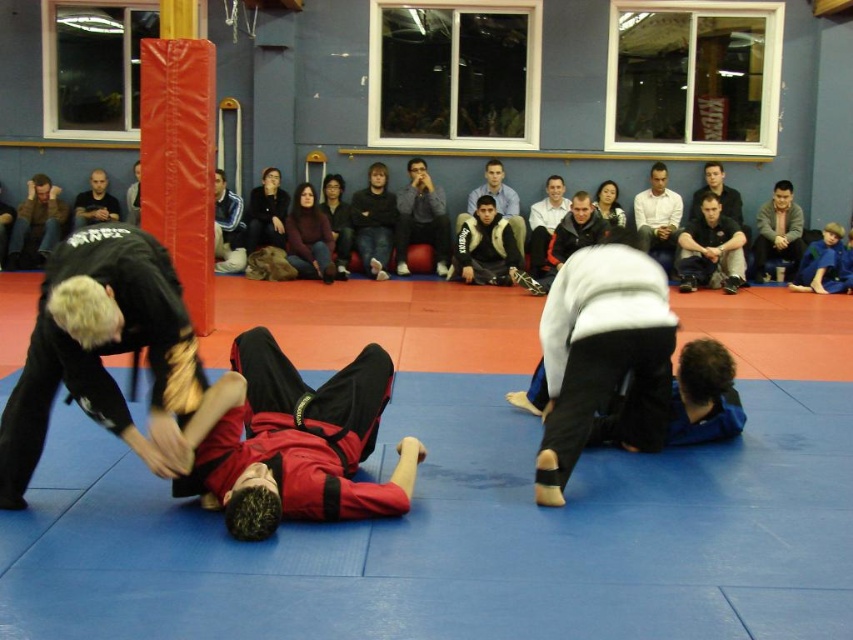
You are a martial arts instructor observing the training session. You notice a point at coordinates (x=486, y=248) on the image. Which object in the scene is this point located on?

The point at coordinates (x=486, y=248) is located on the dark gray fleece jacket at center.

Consider the image. You are a martial arts instructor observing the training session. You notice the black matte uniform at center and the dark gray sweater at upper right. Which piece of clothing is bigger in size?

The black matte uniform at center is larger in size compared to the dark gray sweater at upper right.

Consider the image. You are a photographer setting up for a martial arts photo shoot. You need to ensure that the dark gray fleece jacket at center and the white shirt at upper center are both visible in the frame. Based on their positions, which object should you focus on first to capture both in the shot?

The dark gray fleece jacket at center is positioned under the white shirt at upper center. To capture both in the frame, focus on the white shirt at upper center first since it is higher up, ensuring the jacket below remains in view.